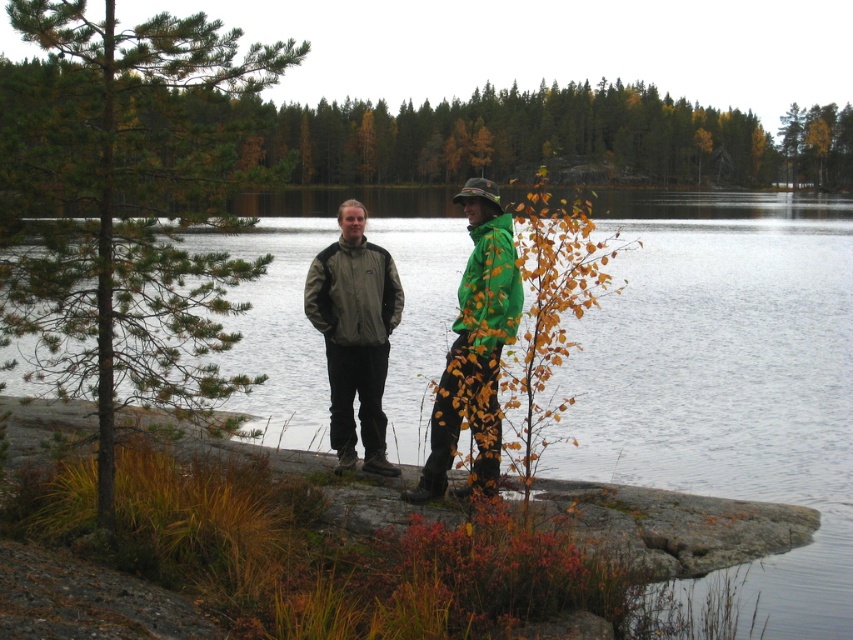
Question: Which object is farther from the camera taking this photo?

Choices:
 (A) green matte tree at upper center
 (B) matte gray jacket at center
 (C) green matte jacket at center
 (D) green pine tree at left

Answer: (B)

Question: Can you confirm if transparent water at center is positioned to the left of green pine tree at left?

Choices:
 (A) no
 (B) yes

Answer: (A)

Question: Which point is farther from the camera taking this photo?

Choices:
 (A) (193, 51)
 (B) (752, 276)
 (C) (485, 182)
 (D) (259, 132)

Answer: (D)

Question: Is green matte tree at upper center to the left of matte gray jacket at center from the viewer's perspective?

Choices:
 (A) yes
 (B) no

Answer: (A)

Question: Is transparent water at center thinner than green matte tree at upper center?

Choices:
 (A) no
 (B) yes

Answer: (B)

Question: Which of the following is the closest to the observer?

Choices:
 (A) transparent water at center
 (B) green matte jacket at center
 (C) matte gray jacket at center

Answer: (A)